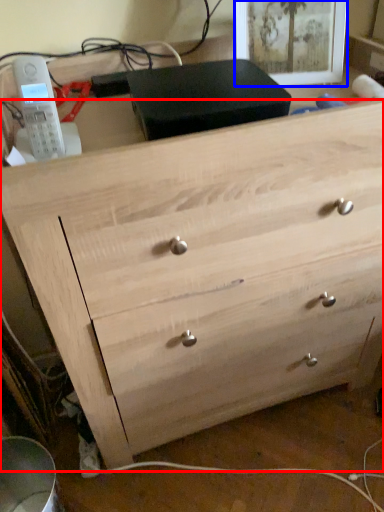
Question: Which object is closer to the camera taking this photo, chest of drawers (highlighted by a red box) or picture frame (highlighted by a blue box)?

Choices:
 (A) chest of drawers
 (B) picture frame

Answer: (A)